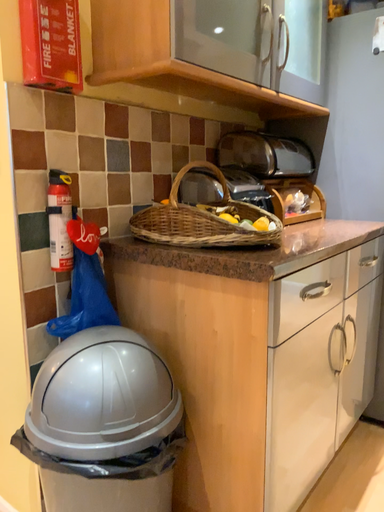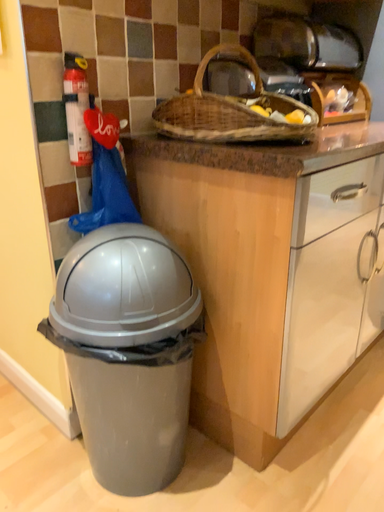
Question: Which way did the camera rotate in the video?

Choices:
 (A) rotated downward
 (B) rotated upward

Answer: (A)